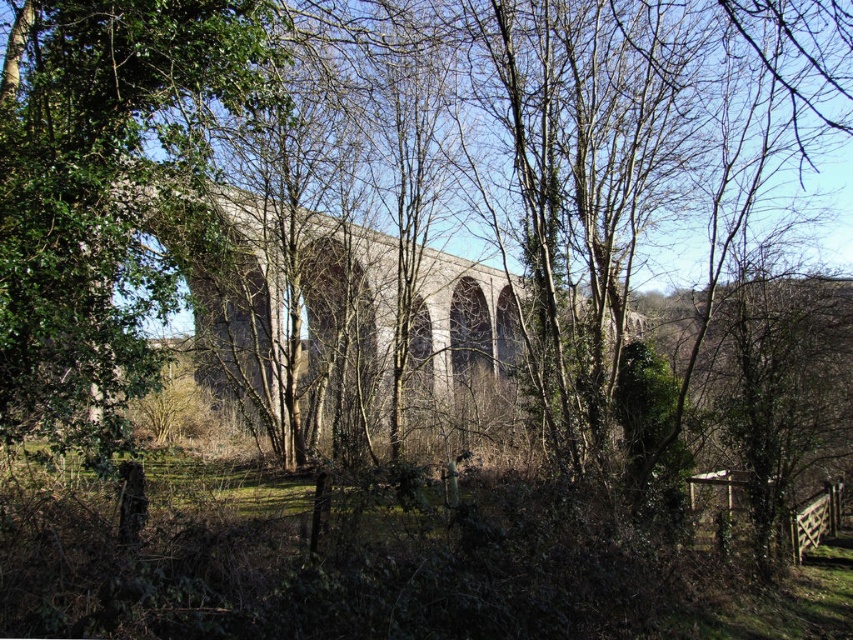
You are standing in front of the viaduct and want to take a photo of the green leafy tree at center and the concrete arches at center. Which object will appear larger in your photo?

The green leafy tree at center will appear larger in your photo because it is closer to the viewer than the concrete arches at center.

You are a landscape architect evaluating the space between the green leafy tree at center and the concrete arches at center. Based on their sizes, which one would require more space to accommodate in a design plan?

The concrete arches at center are larger than the green leafy tree at center, so they would require more space to accommodate in a design plan.

You are a landscape architect planning to install a new pathway between the green leafy tree at center and the concrete arches at center. The pathway requires a minimum of 4 meters of space. Can the existing space accommodate this pathway?

The green leafy tree at center is 4.26 meters from the concrete arches at center, which is more than the required 4 meters, so the pathway can be installed in the existing space.